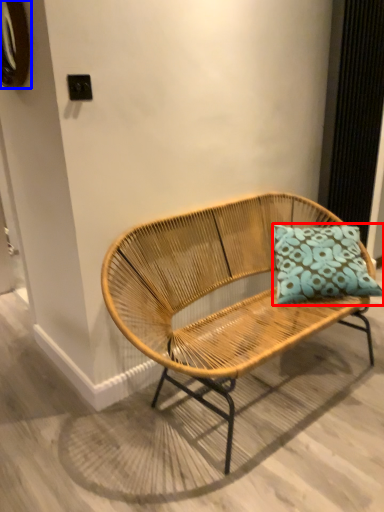
Question: Which object is further to the camera taking this photo, pillow (highlighted by a red box) or oval (highlighted by a blue box)?

Choices:
 (A) pillow
 (B) oval

Answer: (A)